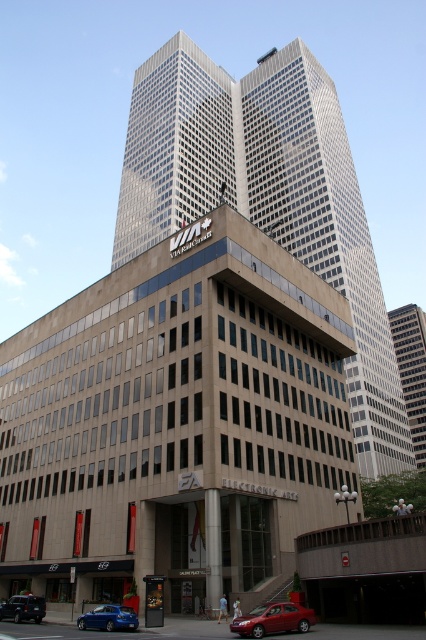
Consider the image. You are a delivery driver who needs to park your truck, which is 40 feet long, between the glassy reflective skyscraper at center and the shiny red sedan at lower center. Is there enough space for your truck?

The distance between the glassy reflective skyscraper at center and the shiny red sedan at lower center is 377.08 feet. Since your truck is only 40 feet long, there is more than enough space to park it between them.

You are a delivery driver who needs to park your metallic blue hatchback at lower left near the glassy steel skyscraper at center. Given that the parking spot is 5 meters away from the base of the skyscraper, will your car fit without touching the building?

The glassy steel skyscraper at center is larger in size than the metallic blue hatchback at lower left, but the parking spot is 5 meters away from the base of the skyscraper. Since the distance provided is sufficient for parking, the metallic blue hatchback at lower left can fit without touching the building.